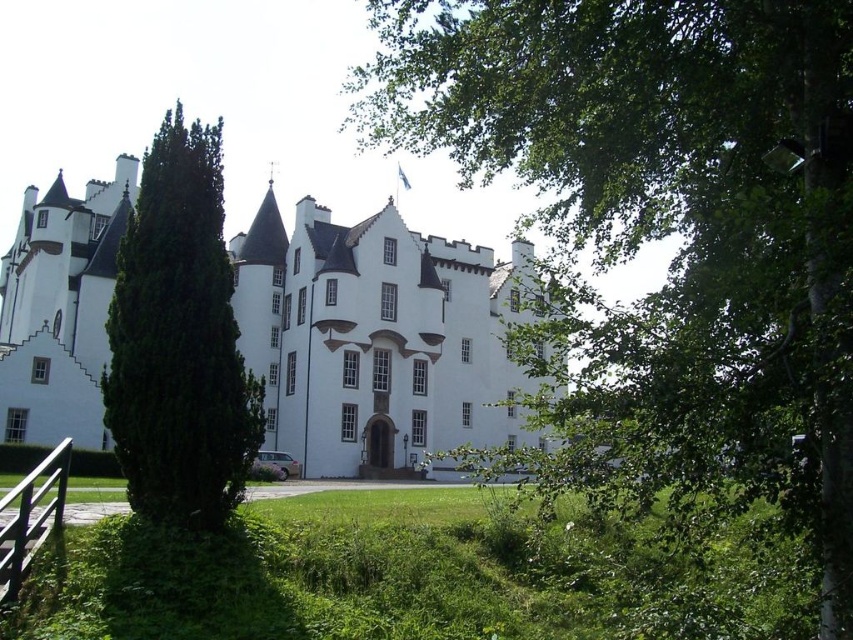
Question: Which is farther from the green leafy tree at center?

Choices:
 (A) white stone castle at center
 (B) green leafy tree at left

Answer: (B)

Question: Which point is farther to the camera?

Choices:
 (A) white stone castle at center
 (B) green leafy tree at left

Answer: (A)

Question: Which point is farther to the camera?

Choices:
 (A) green leafy tree at center
 (B) white stone castle at center

Answer: (B)

Question: Is green leafy tree at center to the right of white stone castle at center from the viewer's perspective?

Choices:
 (A) yes
 (B) no

Answer: (A)

Question: Does green leafy tree at center appear over white stone castle at center?

Choices:
 (A) no
 (B) yes

Answer: (B)

Question: Is green leafy tree at center to the left of green leafy tree at left from the viewer's perspective?

Choices:
 (A) yes
 (B) no

Answer: (B)